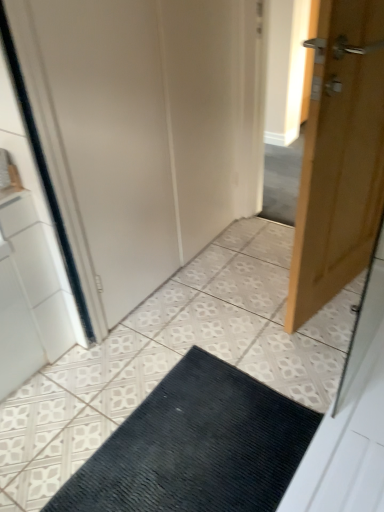
Question: In terms of width, does black textured mat at center look wider or thinner when compared to white matte door at center?

Choices:
 (A) wide
 (B) thin

Answer: (B)

Question: Is black textured mat at center situated inside white matte door at center or outside?

Choices:
 (A) inside
 (B) outside

Answer: (B)

Question: Which object is the closest to the light brown wooden door at right?

Choices:
 (A) white matte door at center
 (B) black textured mat at center

Answer: (A)

Question: Based on their relative distances, which object is nearer to the light brown wooden door at right?

Choices:
 (A) black textured mat at center
 (B) white matte door at center

Answer: (B)